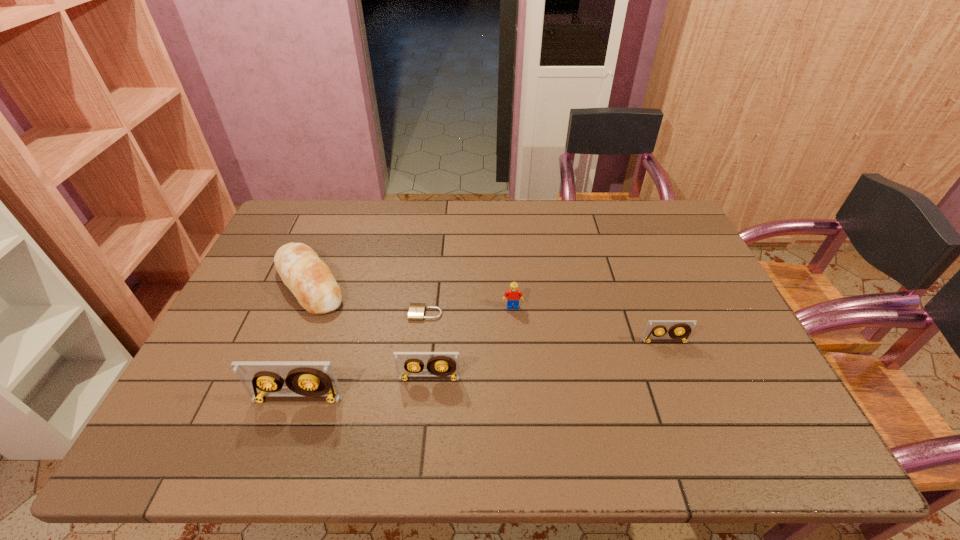
At what (x,y) coordinates should I click in order to perform the action: click on object identified as the third closest to the shortest object. Please return your answer as a coordinate pair (x, y). The height and width of the screenshot is (540, 960). Looking at the image, I should click on (310, 280).

Find the location of `videotape that is the closest to the second nearest videotape`. videotape that is the closest to the second nearest videotape is located at coordinates (x=306, y=380).

Identify the location of videotape that is the second closest one to the second shortest videotape. The width and height of the screenshot is (960, 540). 679,329.